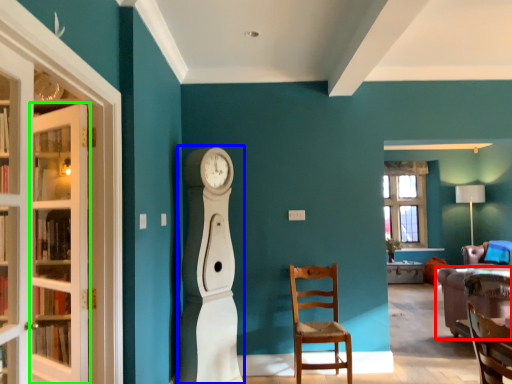
Question: Based on their relative distances, which object is farther from studio couch (highlighted by a red box)? Choose from open (highlighted by a blue box) and door (highlighted by a green box).

Choices:
 (A) open
 (B) door

Answer: (B)